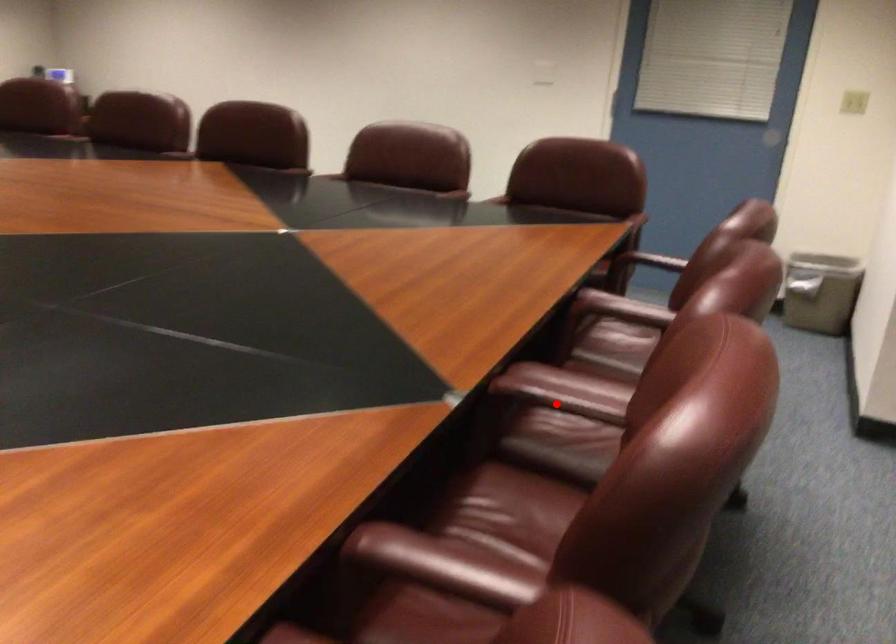
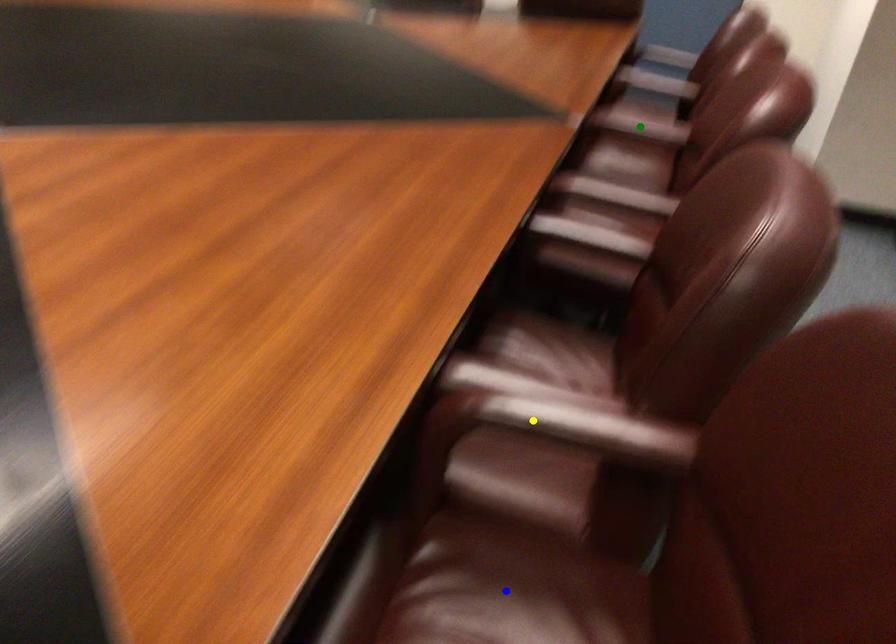
Question: I am providing you with two images of the same scene from different viewpoints. A red point is marked on the first image. You are given multiple points on the second image. Which spot in image 2 lines up with the point in image 1?

Choices:
 (A) green point
 (B) blue point
 (C) yellow point

Answer: (A)